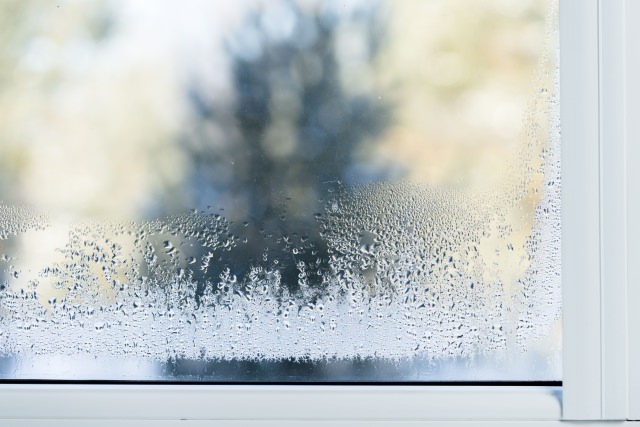
The image size is (640, 427). In order to click on shadow of the side of the window in this screenshot , I will do `click(559, 393)`.